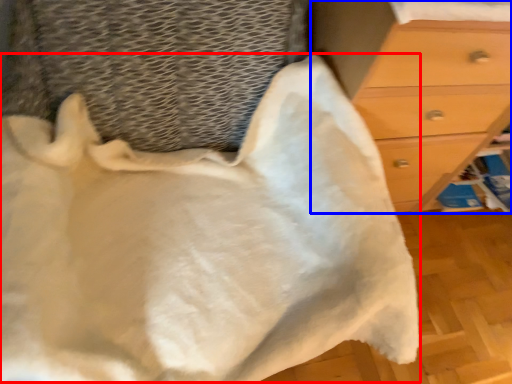
Question: Which object appears closest to the camera in this image, blanket (highlighted by a red box) or chest of drawers (highlighted by a blue box)?

Choices:
 (A) blanket
 (B) chest of drawers

Answer: (A)